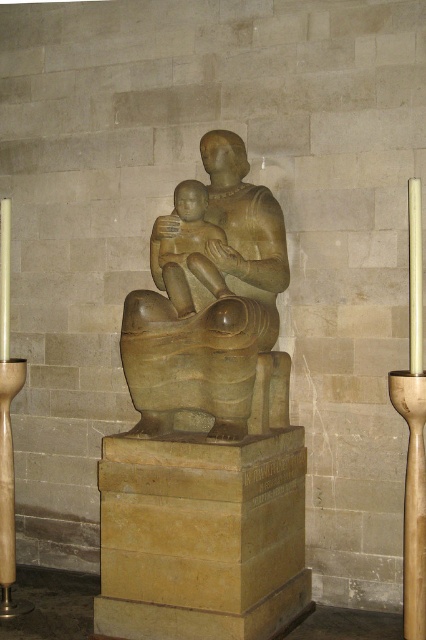
You are a visitor in a museum and see two statues at the center of the room. The first is a matte stone statue at center and the second is a matte bronze statue at center. According to their positions, which statue is on the right side when viewed from the front?

The matte stone statue at center is positioned on the right side of the matte bronze statue at center, so when viewed from the front, the matte stone statue at center is on the right.

You are an art curator planning to display both the matte stone statue at center and the matte bronze statue at center in a gallery. Given their heights, which statue should be placed on the lower shelf to ensure proper visibility for visitors?

The matte bronze statue at center should be placed on the lower shelf because it is shorter than the matte stone statue at center, allowing visitors to view both statues comfortably without obstruction.

You are an interior designer arranging a gallery space. You need to place a new artwork to the left of the wooden candle holder at lower left. Will the new artwork interfere with the matte stone statue at center?

The matte stone statue at center is to the right of the wooden candle holder at lower left, so placing the new artwork to the left of the wooden candle holder at lower left would not interfere with the matte stone statue at center since it is positioned further to the right.